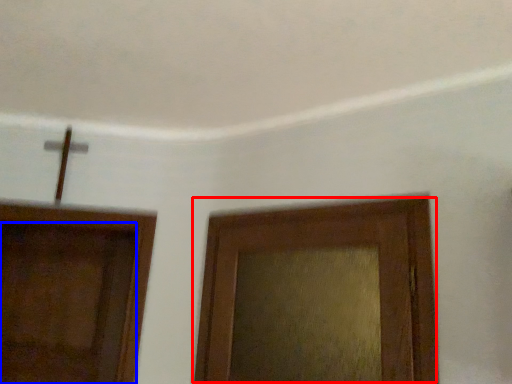
Question: Which object is closer to the camera taking this photo, door (highlighted by a red box) or door (highlighted by a blue box)?

Choices:
 (A) door
 (B) door

Answer: (A)